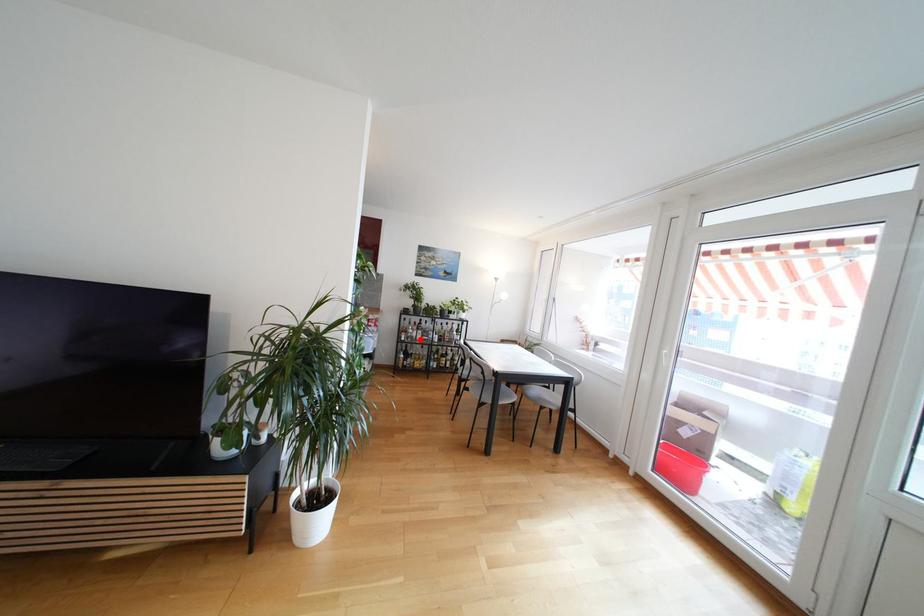
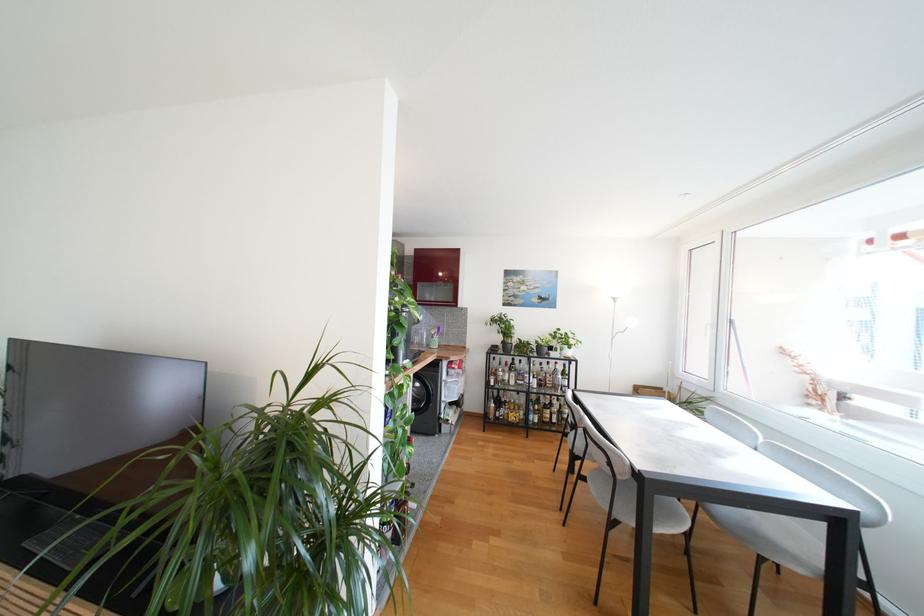
Question: I am providing you with two images of the same scene from different viewpoints. A red point is marked on the first image. At the location where the point appears in image 1, is it still visible in image 2?

Choices:
 (A) Yes
 (B) No

Answer: (A)